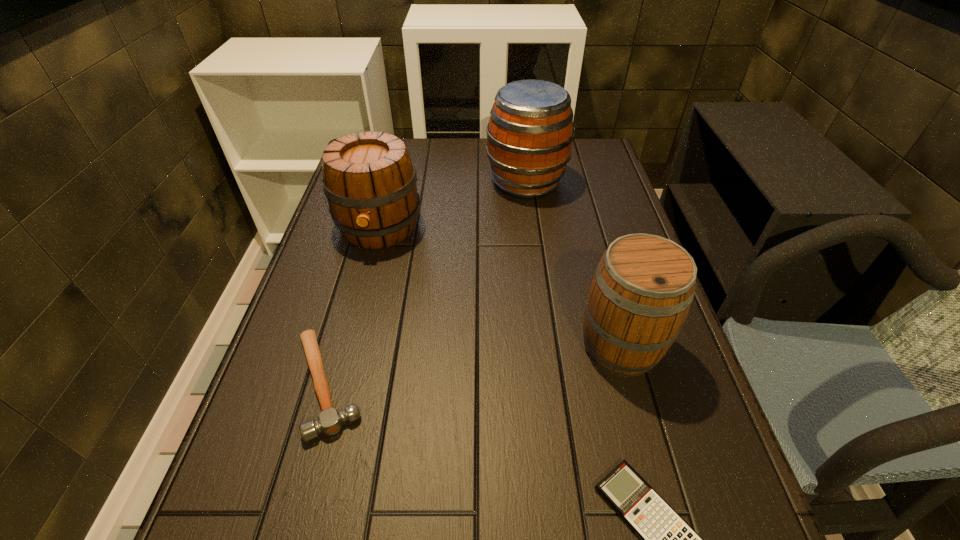
The image size is (960, 540). In order to click on the nearest cider in this screenshot , I will do `click(642, 290)`.

Where is `the leftmost cider`? This screenshot has height=540, width=960. the leftmost cider is located at coordinates (370, 184).

Where is `hammer`? hammer is located at coordinates (330, 420).

Locate an element on the screen. free region located 0.060m on the left of the nearest cider is located at coordinates (550, 346).

I want to click on vacant space situated 0.360m on the side of the leftmost cider where the spigot is located, so click(339, 382).

The image size is (960, 540). Identify the location of vacant point located on the back of the hammer. (372, 220).

The image size is (960, 540). What are the coordinates of `object located at the far edge` in the screenshot? It's located at (529, 135).

Where is `cider that is at the left edge`? cider that is at the left edge is located at coordinates (370, 184).

Locate an element on the screen. This screenshot has width=960, height=540. hammer located in the left edge section of the desktop is located at coordinates [330, 420].

Image resolution: width=960 pixels, height=540 pixels. I want to click on object that is at the far right corner, so click(x=529, y=135).